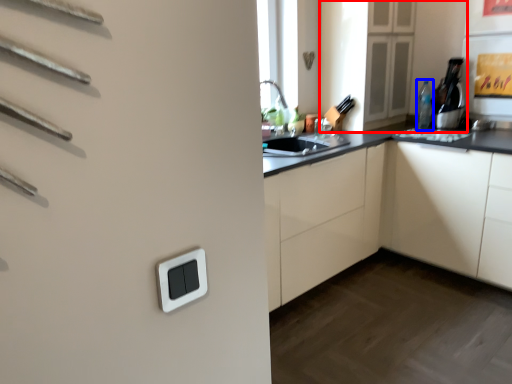
Question: Which object is closer to the camera taking this photo, cabinetry (highlighted by a red box) or bottle (highlighted by a blue box)?

Choices:
 (A) cabinetry
 (B) bottle

Answer: (A)